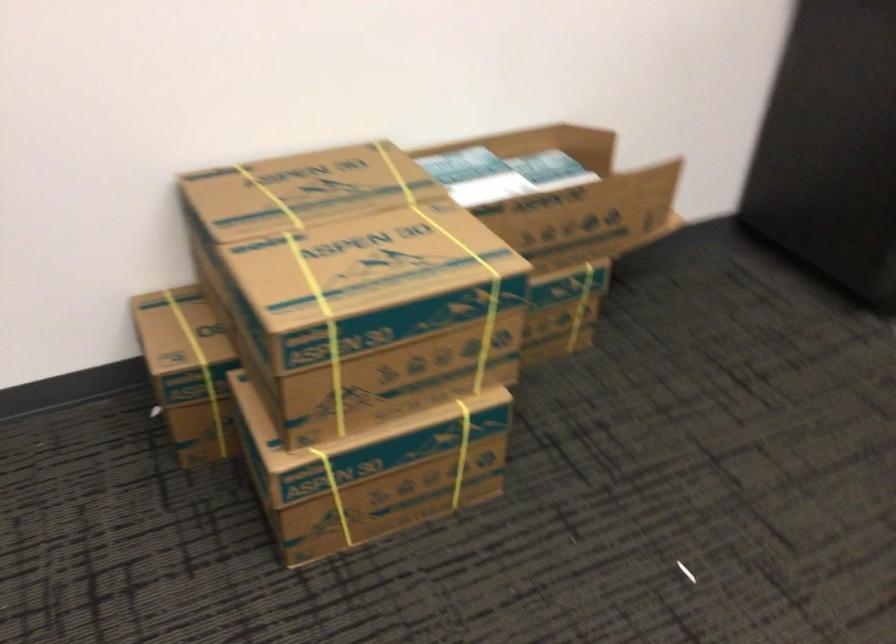
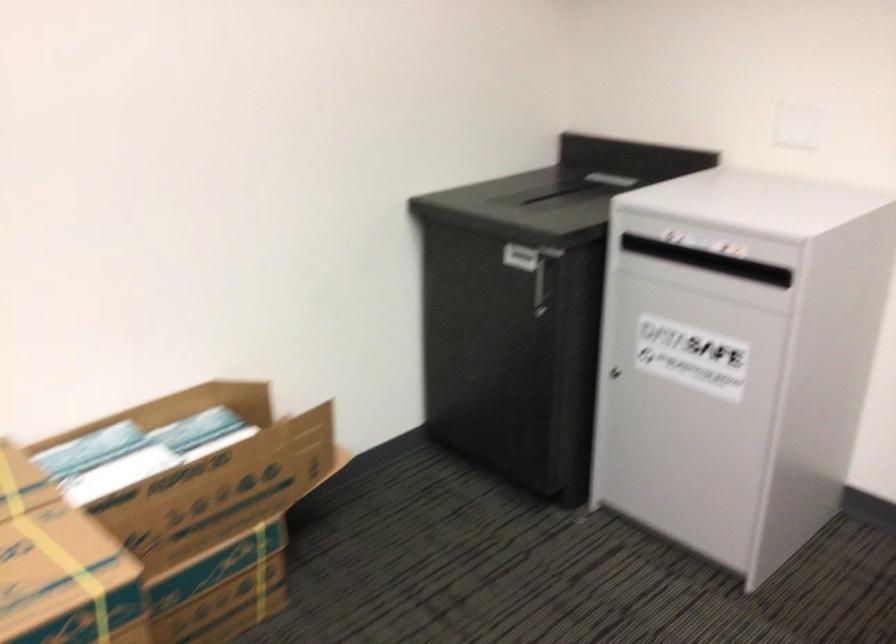
Locate, in the second image, the point that corresponds to (x=547, y=142) in the first image.

(211, 402)